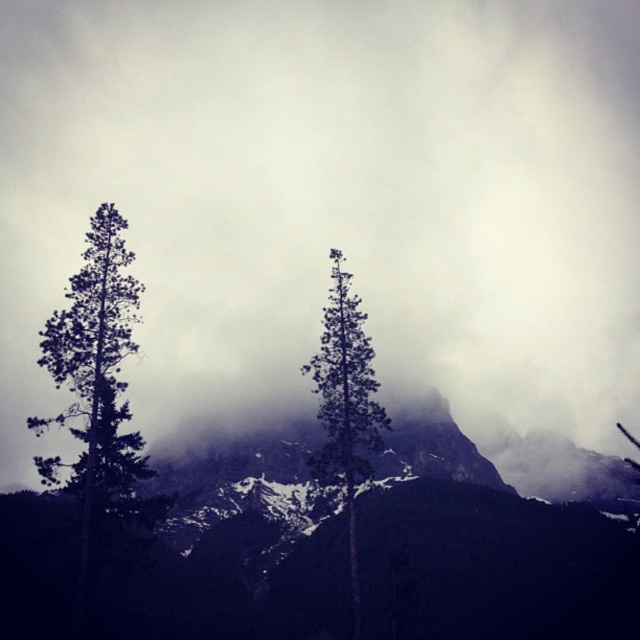
Who is positioned more to the left, smokey gray rock at center or dark green textured tree at left?

Positioned to the left is dark green textured tree at left.

Between smokey gray rock at center and dark green textured tree at left, which one appears on the right side from the viewer's perspective?

From the viewer's perspective, smokey gray rock at center appears more on the right side.

Identify the location of smokey gray rock at center. (486, 554).

Identify the location of smokey gray rock at center. This screenshot has width=640, height=640. (486, 554).

Can you confirm if smokey gray rock at center is thinner than green matte tree at center?

Incorrect, smokey gray rock at center's width is not less than green matte tree at center's.

Does point (524, 520) come in front of point (320, 412)?

No, (524, 520) is further to viewer.

In order to click on smokey gray rock at center in this screenshot , I will do `click(486, 554)`.

Is dark green textured tree at left shorter than green matte tree at center?

No.

What do you see at coordinates (99, 381) in the screenshot?
I see `dark green textured tree at left` at bounding box center [99, 381].

Who is more distant from viewer, (90, 436) or (332, 310)?

Point (332, 310)

I want to click on dark green textured tree at left, so pyautogui.click(x=99, y=381).